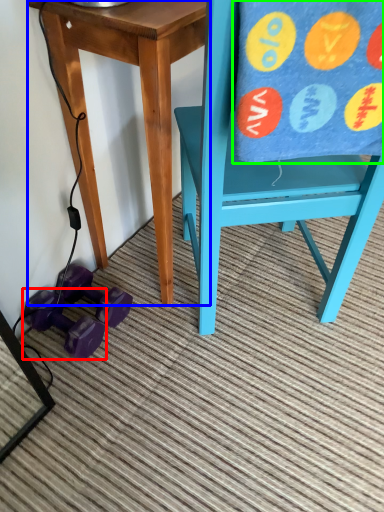
Question: Which object is positioned closest to dumbbell (highlighted by a red box)? Select from table (highlighted by a blue box) and beach towel (highlighted by a green box).

Choices:
 (A) table
 (B) beach towel

Answer: (A)